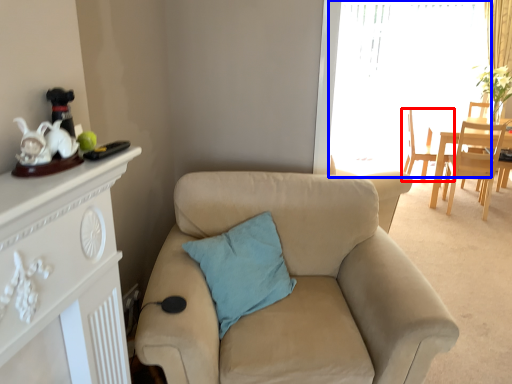
Question: Which of the following is the farthest to the observer, chair (highlighted by a red box) or window screen (highlighted by a blue box)?

Choices:
 (A) chair
 (B) window screen

Answer: (B)